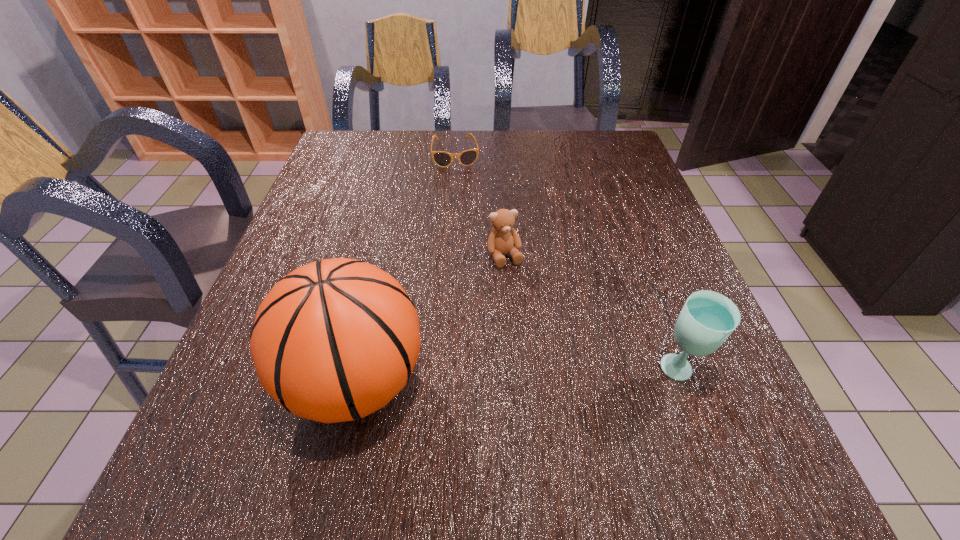
Locate an element on the screen. vacant space on the desktop that is between the basketball and the rightmost object and is positioned on the front-facing side of the shortest object is located at coordinates (489, 378).

You are a GUI agent. You are given a task and a screenshot of the screen. Output one action in this format:
    pyautogui.click(x=<x>, y=<y>)
    Task: Click on the free spot on the desktop that is between the tallest object and the rightmost object and is positioned on the face of the teddy bear
    The height and width of the screenshot is (540, 960).
    Given the screenshot: What is the action you would take?
    pyautogui.click(x=558, y=375)